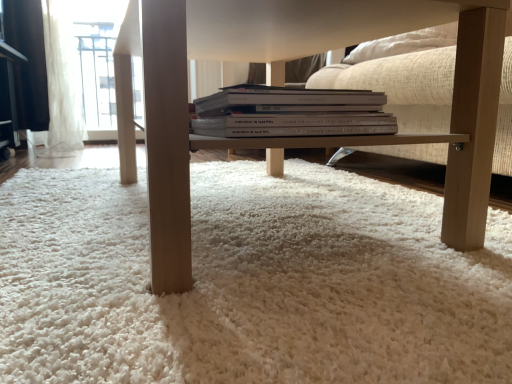
Identify the location of white paper book at center. (292, 113).

At what (x,y) coordinates should I click in order to perform the action: click on white fluffy carpet at center. Please return your answer as a coordinate pair (x, y). This screenshot has height=384, width=512. Looking at the image, I should click on (249, 283).

Locate an element on the screen. light wood table at center is located at coordinates (298, 56).

In the image, is white paper book at center positioned in front of or behind white fluffy carpet at center?

Visually, white paper book at center is located behind white fluffy carpet at center.

Is point (388, 115) positioned after point (67, 377)?

Yes, it is behind point (67, 377).

From a real-world perspective, which object rests below the other?

light wood table at center is physically lower.

Is light wood table at center positioned far away from white paper book at center?

They are positioned close to each other.

Considering the positions of objects light wood table at center and white paper book at center in the image provided, who is behind, light wood table at center or white paper book at center?

white paper book at center is further from the camera.

From their relative heights in the image, would you say light wood table at center is taller or shorter than white fluffy carpet at center?

light wood table at center is taller than white fluffy carpet at center.

How different are the orientations of light wood table at center and white fluffy carpet at center in degrees?

The facing directions of light wood table at center and white fluffy carpet at center are 9.53e-05 degrees apart.

Is light wood table at center in front of or behind white fluffy carpet at center in the image?

In the image, light wood table at center appears behind white fluffy carpet at center.

Are light wood table at center and white fluffy carpet at center far apart?

That's not correct — light wood table at center is a little close to white fluffy carpet at center.

From the image's perspective, would you say white paper book at center is positioned over white sheer curtain at upper left?

Actually, white paper book at center appears below white sheer curtain at upper left in the image.

Considering the relative positions of white paper book at center and white sheer curtain at upper left in the image provided, is white paper book at center behind white sheer curtain at upper left?

No, it is not.

Which is nearer, [277,90] or [71,150]?

Point [277,90] is positioned closer to the camera compared to point [71,150].

Which object is positioned more to the left, white paper book at center or white sheer curtain at upper left?

Positioned to the left is white sheer curtain at upper left.

Are light wood table at center and white sheer curtain at upper left located far from each other?

That's right, there is a large distance between light wood table at center and white sheer curtain at upper left.

Is point (471, 4) closer or farther from the camera than point (49, 149)?

Point (471, 4) is closer to the camera than point (49, 149).

Is white sheer curtain at upper left located within light wood table at center?

Actually, white sheer curtain at upper left is outside light wood table at center.

Does light wood table at center turn towards white sheer curtain at upper left?

No, light wood table at center does not turn towards white sheer curtain at upper left.

Does white sheer curtain at upper left have a smaller size compared to white fluffy carpet at center?

Yes.

I want to click on curtain on the left side of white fluffy carpet at center, so 62,83.

Can you see white sheer curtain at upper left touching white fluffy carpet at center?

There is a gap between white sheer curtain at upper left and white fluffy carpet at center.

From the picture: From a real-world perspective, who is located higher, white sheer curtain at upper left or white fluffy carpet at center?

white sheer curtain at upper left.

Between white paper book at center and light wood table at center, which one appears on the right side from the viewer's perspective?

From the viewer's perspective, white paper book at center appears more on the right side.

Can you confirm if white paper book at center is shorter than light wood table at center?

Correct, white paper book at center is not as tall as light wood table at center.

Considering the sizes of objects white paper book at center and light wood table at center in the image provided, who is bigger, white paper book at center or light wood table at center?

light wood table at center is bigger.

Find the location of a particular element. Image resolution: width=512 pixels, height=384 pixels. plain in front of the white paper book at center is located at coordinates (249, 283).

Identify the location of table on the left of white paper book at center. This screenshot has width=512, height=384. (298, 56).

Based on their spatial positions, is light wood table at center or white sheer curtain at upper left further from white fluffy carpet at center?

white sheer curtain at upper left lies further to white fluffy carpet at center than the other object.

Looking at the image, which one is located further to white paper book at center, white fluffy carpet at center or white sheer curtain at upper left?

white sheer curtain at upper left is further to white paper book at center.

Based on their spatial positions, is white sheer curtain at upper left or white paper book at center further from white fluffy carpet at center?

white sheer curtain at upper left lies further to white fluffy carpet at center than the other object.

When comparing their distances from white paper book at center, does light wood table at center or white fluffy carpet at center seem closer?

Based on the image, light wood table at center appears to be nearer to white paper book at center.

Based on their spatial positions, is white paper book at center or white fluffy carpet at center closer to light wood table at center?

white paper book at center is positioned closer to the anchor light wood table at center.

Looking at the image, which one is located further to light wood table at center, white fluffy carpet at center or white sheer curtain at upper left?

Among the two, white sheer curtain at upper left is located further to light wood table at center.

Based on their spatial positions, is white fluffy carpet at center or light wood table at center closer to white sheer curtain at upper left?

Among the two, light wood table at center is located nearer to white sheer curtain at upper left.

When comparing their distances from white paper book at center, does white sheer curtain at upper left or light wood table at center seem further?

The object further to white paper book at center is white sheer curtain at upper left.

Where is `table located between white fluffy carpet at center and white sheer curtain at upper left in the depth direction`? The height and width of the screenshot is (384, 512). table located between white fluffy carpet at center and white sheer curtain at upper left in the depth direction is located at coordinates (298, 56).

Image resolution: width=512 pixels, height=384 pixels. Identify the location of table between white fluffy carpet at center and white paper book at center along the z-axis. (298, 56).

I want to click on book between light wood table at center and white sheer curtain at upper left from front to back, so click(292, 113).

This screenshot has width=512, height=384. In order to click on book located between white fluffy carpet at center and white sheer curtain at upper left in the depth direction in this screenshot , I will do `click(292, 113)`.